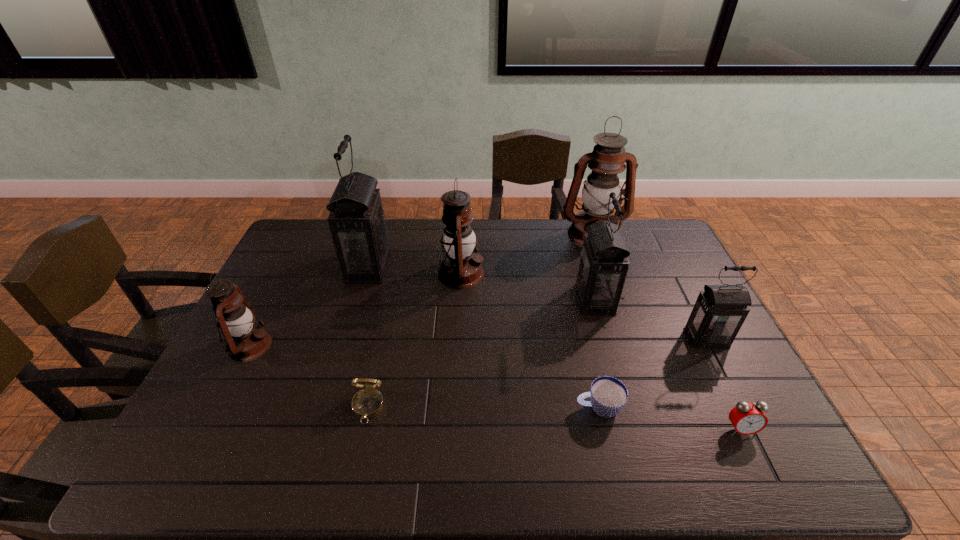
Where is `free space between the blue cup and the compass`? Image resolution: width=960 pixels, height=540 pixels. free space between the blue cup and the compass is located at coordinates (483, 407).

What are the coordinates of `vacant space that is in between the biggest brown lantern and the smallest brown lantern` in the screenshot? It's located at (422, 290).

Identify which object is the fourth nearest to the compass. Please provide its 2D coordinates. Your answer should be formatted as a tuple, i.e. [(x, y)], where the tuple contains the x and y coordinates of a point satisfying the conditions above.

[(608, 395)]

Where is `object that ranks as the second closest to the smallest brown lantern`? This screenshot has height=540, width=960. object that ranks as the second closest to the smallest brown lantern is located at coordinates (367, 403).

Select which lantern appears as the sixth closest to the compass. Please provide its 2D coordinates. Your answer should be formatted as a tuple, i.e. [(x, y)], where the tuple contains the x and y coordinates of a point satisfying the conditions above.

[(720, 310)]

Select which lantern appears as the fourth closest to the red alarm clock. Please provide its 2D coordinates. Your answer should be formatted as a tuple, i.e. [(x, y)], where the tuple contains the x and y coordinates of a point satisfying the conditions above.

[(461, 268)]

What are the coordinates of `brown lantern that is the second nearest to the compass` in the screenshot? It's located at (461, 268).

Locate which brown lantern ranks third in proximity to the fifth lantern from right to left. Please provide its 2D coordinates. Your answer should be formatted as a tuple, i.e. [(x, y)], where the tuple contains the x and y coordinates of a point satisfying the conditions above.

[(609, 155)]

Locate which gray lantern is the closest to the second smallest gray lantern. Please provide its 2D coordinates. Your answer should be formatted as a tuple, i.e. [(x, y)], where the tuple contains the x and y coordinates of a point satisfying the conditions above.

[(720, 310)]

Find the location of a particular element. gray lantern that stands as the closest to the leftmost gray lantern is located at coordinates (603, 265).